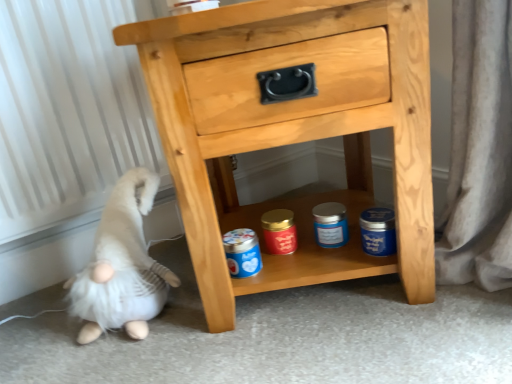
Identify the location of white plush gnome at lower left. The height and width of the screenshot is (384, 512). (122, 266).

This screenshot has width=512, height=384. What do you see at coordinates (122, 266) in the screenshot?
I see `white plush gnome at lower left` at bounding box center [122, 266].

Measure the distance between white plush gnome at lower left and camera.

white plush gnome at lower left and camera are 33.82 inches apart.

You are a GUI agent. You are given a task and a screenshot of the screen. Output one action in this format:
    pyautogui.click(x=<x>, y=<y>)
    Task: Click on the natural wood chest of drawers at center
    
    Given the screenshot: What is the action you would take?
    pyautogui.click(x=293, y=141)

This screenshot has height=384, width=512. What do you see at coordinates (293, 141) in the screenshot? I see `natural wood chest of drawers at center` at bounding box center [293, 141].

The width and height of the screenshot is (512, 384). I want to click on white plush gnome at lower left, so click(122, 266).

Between natural wood chest of drawers at center and white plush gnome at lower left, which one appears on the right side from the viewer's perspective?

Positioned to the right is natural wood chest of drawers at center.

Is natural wood chest of drawers at center positioned before white plush gnome at lower left?

Yes, the depth of natural wood chest of drawers at center is less than that of white plush gnome at lower left.

Is point (405, 60) behind point (123, 219)?

No, it is not.

Consider the image. From the image's perspective, is natural wood chest of drawers at center positioned above or below white plush gnome at lower left?

Based on their image positions, natural wood chest of drawers at center is located above white plush gnome at lower left.

From a real-world perspective, which object stands above the other?

In real-world perspective, natural wood chest of drawers at center is above.

Considering the sizes of objects natural wood chest of drawers at center and white plush gnome at lower left in the image provided, who is thinner, natural wood chest of drawers at center or white plush gnome at lower left?

white plush gnome at lower left is thinner.

Considering the sizes of natural wood chest of drawers at center and white plush gnome at lower left in the image, is natural wood chest of drawers at center taller or shorter than white plush gnome at lower left?

Clearly, natural wood chest of drawers at center is taller compared to white plush gnome at lower left.

Which of these two, natural wood chest of drawers at center or white plush gnome at lower left, is bigger?

Bigger between the two is natural wood chest of drawers at center.

Is natural wood chest of drawers at center outside of white plush gnome at lower left?

Absolutely, natural wood chest of drawers at center is external to white plush gnome at lower left.

Are natural wood chest of drawers at center and white plush gnome at lower left located far from each other?

They are positioned close to each other.

Could you tell me if natural wood chest of drawers at center is facing white plush gnome at lower left?

No, natural wood chest of drawers at center is not aimed at white plush gnome at lower left.

How different are the orientations of natural wood chest of drawers at center and white plush gnome at lower left in degrees?

The angle between the facing direction of natural wood chest of drawers at center and the facing direction of white plush gnome at lower left is 7.68 degrees.

Identify the location of animal lying below the natural wood chest of drawers at center (from the image's perspective). pyautogui.click(x=122, y=266).

Considering the relative positions of white plush gnome at lower left and natural wood chest of drawers at center in the image provided, is white plush gnome at lower left to the left of natural wood chest of drawers at center from the viewer's perspective?

Yes.

Is white plush gnome at lower left further to camera compared to natural wood chest of drawers at center?

Yes, white plush gnome at lower left is behind natural wood chest of drawers at center.

Between point (139, 239) and point (240, 283), which one is positioned in front?

Point (240, 283)

From the image's perspective, does white plush gnome at lower left appear lower than natural wood chest of drawers at center?

Indeed, from the image's perspective, white plush gnome at lower left is shown beneath natural wood chest of drawers at center.

From a real-world perspective, is white plush gnome at lower left positioned over natural wood chest of drawers at center based on gravity?

No, from a real-world perspective, white plush gnome at lower left is not on top of natural wood chest of drawers at center.

Can you confirm if white plush gnome at lower left is thinner than natural wood chest of drawers at center?

Yes, white plush gnome at lower left is thinner than natural wood chest of drawers at center.

Considering the relative sizes of white plush gnome at lower left and natural wood chest of drawers at center in the image provided, is white plush gnome at lower left shorter than natural wood chest of drawers at center?

Indeed, white plush gnome at lower left has a lesser height compared to natural wood chest of drawers at center.

Consider the image. Considering the sizes of white plush gnome at lower left and natural wood chest of drawers at center in the image, is white plush gnome at lower left bigger or smaller than natural wood chest of drawers at center?

Considering their sizes, white plush gnome at lower left takes up less space than natural wood chest of drawers at center.

Is natural wood chest of drawers at center inside white plush gnome at lower left?

That's incorrect, natural wood chest of drawers at center is not inside white plush gnome at lower left.

Is there a large distance between white plush gnome at lower left and natural wood chest of drawers at center?

No, white plush gnome at lower left is in close proximity to natural wood chest of drawers at center.

Is white plush gnome at lower left oriented away from natural wood chest of drawers at center?

That's not correct — white plush gnome at lower left is not looking away from natural wood chest of drawers at center.

The height and width of the screenshot is (384, 512). Find the location of `animal below the natural wood chest of drawers at center (from the image's perspective)`. animal below the natural wood chest of drawers at center (from the image's perspective) is located at coordinates (122, 266).

Image resolution: width=512 pixels, height=384 pixels. In the image, there is a natural wood chest of drawers at center. Find the location of `animal below it (from a real-world perspective)`. animal below it (from a real-world perspective) is located at coordinates (122, 266).

Locate an element on the screen. The height and width of the screenshot is (384, 512). animal that appears on the left of natural wood chest of drawers at center is located at coordinates (122, 266).